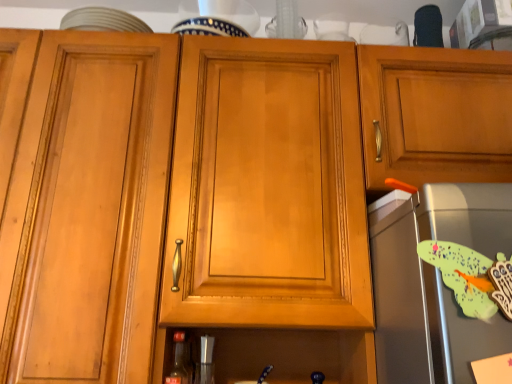
The height and width of the screenshot is (384, 512). What are the coordinates of `satin silver toaster at right, acting as the first appliance starting from the right` in the screenshot? It's located at (438, 281).

How different are the orientations of metallic silver shaker at lower center, the first appliance ordered from the bottom, and matte glass bottle at lower center in degrees?

0.0041 degrees.

From a real-world perspective, is metallic silver shaker at lower center, arranged as the first appliance when viewed from the left, positioned over matte glass bottle at lower center based on gravity?

No, from a real-world perspective, metallic silver shaker at lower center, arranged as the first appliance when viewed from the left, is not above matte glass bottle at lower center.

Looking at this image, would you say metallic silver shaker at lower center, arranged as the 2th appliance when viewed from the top, is inside or outside matte glass bottle at lower center?

metallic silver shaker at lower center, arranged as the 2th appliance when viewed from the top, is not inside matte glass bottle at lower center, it's outside.

Where is `bottle on the left of metallic silver shaker at lower center, the first appliance positioned from the back`? Image resolution: width=512 pixels, height=384 pixels. bottle on the left of metallic silver shaker at lower center, the first appliance positioned from the back is located at coordinates (179, 362).

Which of these two, matte glass bottle at lower center or metallic silver shaker at lower center, which ranks as the 2th appliance in front-to-back order, is wider?

matte glass bottle at lower center is wider.

Is point (175, 364) closer or farther from the camera than point (212, 364)?

Point (175, 364) is closer to the camera than point (212, 364).

In terms of size, does matte glass bottle at lower center appear bigger or smaller than metallic silver shaker at lower center, arranged as the 2th appliance when viewed from the top?

matte glass bottle at lower center is smaller than metallic silver shaker at lower center, arranged as the 2th appliance when viewed from the top.

Could you measure the distance between matte glass bottle at lower center and satin silver toaster at right, the 2th appliance positioned from the bottom?

matte glass bottle at lower center is 23.55 inches from satin silver toaster at right, the 2th appliance positioned from the bottom.

Are matte glass bottle at lower center and satin silver toaster at right, the 1th appliance viewed from the top, located far from each other?

No, matte glass bottle at lower center is not far away from satin silver toaster at right, the 1th appliance viewed from the top.

From the image's perspective, does matte glass bottle at lower center appear lower than satin silver toaster at right, the 2th appliance from the back?

Yes.

From a real-world perspective, is matte glass bottle at lower center physically located above or below satin silver toaster at right, the 1th appliance viewed from the top?

In terms of real-world spatial position, matte glass bottle at lower center is below satin silver toaster at right, the 1th appliance viewed from the top.

Which is in front, metallic silver shaker at lower center, arranged as the 2th appliance when viewed from the top, or satin silver toaster at right, the 2th appliance positioned from the bottom?

satin silver toaster at right, the 2th appliance positioned from the bottom, is more forward.

From the image's perspective, is metallic silver shaker at lower center, arranged as the 2th appliance when viewed from the top, located beneath satin silver toaster at right, acting as the first appliance starting from the right?

Yes, from the image's perspective, metallic silver shaker at lower center, arranged as the 2th appliance when viewed from the top, is below satin silver toaster at right, acting as the first appliance starting from the right.

Identify the location of appliance that is below the satin silver toaster at right, the 1th appliance viewed from the top (from the image's perspective). (205, 361).

Does satin silver toaster at right, acting as the first appliance starting from the right, turn towards matte glass bottle at lower center?

No, satin silver toaster at right, acting as the first appliance starting from the right, is not aimed at matte glass bottle at lower center.

Which point is more distant from viewer, (444, 322) or (174, 358)?

The point (174, 358) is behind.

Is satin silver toaster at right, positioned as the 1th appliance in front-to-back order, beside matte glass bottle at lower center?

satin silver toaster at right, positioned as the 1th appliance in front-to-back order, and matte glass bottle at lower center are not in contact.

Is satin silver toaster at right, acting as the first appliance starting from the right, in front of or behind matte glass bottle at lower center in the image?

Clearly, satin silver toaster at right, acting as the first appliance starting from the right, is in front of matte glass bottle at lower center.

Does satin silver toaster at right, the 2th appliance positioned from the bottom, appear on the right side of metallic silver shaker at lower center, the first appliance positioned from the back?

Correct, you'll find satin silver toaster at right, the 2th appliance positioned from the bottom, to the right of metallic silver shaker at lower center, the first appliance positioned from the back.

From the image's perspective, which is below, satin silver toaster at right, acting as the first appliance starting from the right, or metallic silver shaker at lower center, which ranks as the 2th appliance in front-to-back order?

From the image's view, metallic silver shaker at lower center, which ranks as the 2th appliance in front-to-back order, is below.

Who is smaller, satin silver toaster at right, the 2th appliance positioned from the bottom, or metallic silver shaker at lower center, the first appliance positioned from the back?

With smaller size is metallic silver shaker at lower center, the first appliance positioned from the back.

Can you confirm if satin silver toaster at right, the 2th appliance from the back, is thinner than metallic silver shaker at lower center, the first appliance ordered from the bottom?

Incorrect, the width of satin silver toaster at right, the 2th appliance from the back, is not less than that of metallic silver shaker at lower center, the first appliance ordered from the bottom.

In the image, there is a metallic silver shaker at lower center, positioned as the 2th appliance in right-to-left order. Identify the location of bottle above it (from the image's perspective). This screenshot has height=384, width=512. (179, 362).

In the image, there is a matte glass bottle at lower center. Identify the location of appliance below it (from the image's perspective). This screenshot has height=384, width=512. (205, 361).

Based on their spatial positions, is metallic silver shaker at lower center, the first appliance positioned from the back, or matte glass bottle at lower center closer to satin silver toaster at right, the 1th appliance viewed from the top?

metallic silver shaker at lower center, the first appliance positioned from the back, lies closer to satin silver toaster at right, the 1th appliance viewed from the top, than the other object.

Estimate the real-world distances between objects in this image. Which object is closer to matte glass bottle at lower center, metallic silver shaker at lower center, the first appliance positioned from the back, or satin silver toaster at right, the 2th appliance from the back?

metallic silver shaker at lower center, the first appliance positioned from the back.

When comparing their distances from matte glass bottle at lower center, does satin silver toaster at right, the 2th appliance positioned from the bottom, or metallic silver shaker at lower center, the first appliance positioned from the back, seem closer?

metallic silver shaker at lower center, the first appliance positioned from the back, is positioned closer to the anchor matte glass bottle at lower center.

Which object lies nearer to the anchor point metallic silver shaker at lower center, the first appliance positioned from the back, satin silver toaster at right, acting as the first appliance starting from the right, or matte glass bottle at lower center?

Based on the image, matte glass bottle at lower center appears to be nearer to metallic silver shaker at lower center, the first appliance positioned from the back.

From the image, which object appears to be farther from metallic silver shaker at lower center, the first appliance ordered from the bottom, matte glass bottle at lower center or satin silver toaster at right, the 2th appliance from the back?

Based on the image, satin silver toaster at right, the 2th appliance from the back, appears to be further to metallic silver shaker at lower center, the first appliance ordered from the bottom.

Based on their spatial positions, is matte glass bottle at lower center or metallic silver shaker at lower center, the first appliance ordered from the bottom, closer to satin silver toaster at right, the 2th appliance positioned from the bottom?

Among the two, metallic silver shaker at lower center, the first appliance ordered from the bottom, is located nearer to satin silver toaster at right, the 2th appliance positioned from the bottom.

The image size is (512, 384). In order to click on appliance situated between matte glass bottle at lower center and satin silver toaster at right, the 2th appliance from the back, from left to right in this screenshot , I will do `click(205, 361)`.